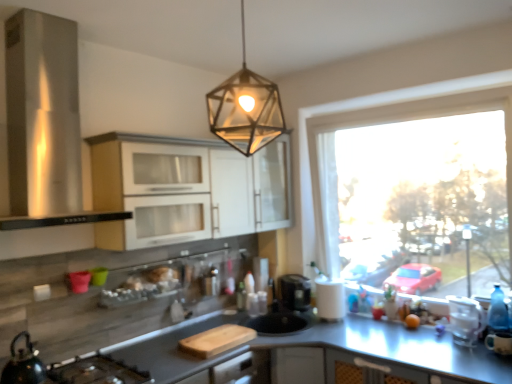
In order to click on vacant space to the right of white matte paper towel at right in this screenshot , I will do `click(359, 322)`.